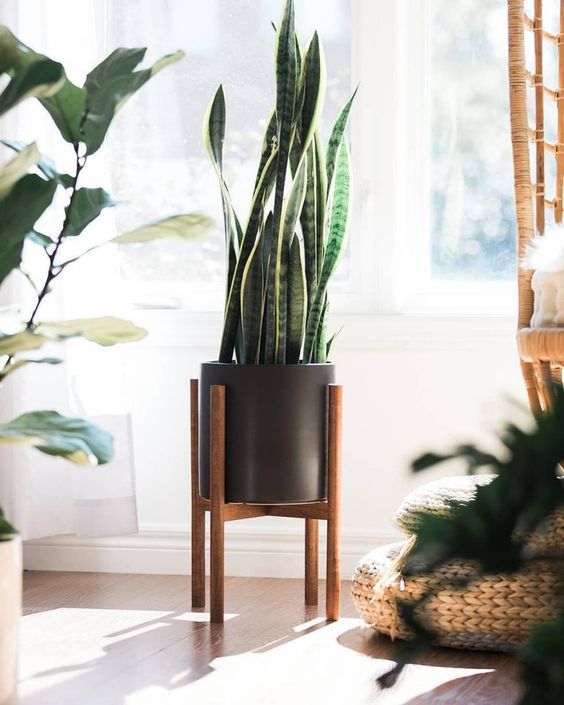
At what (x,y) coordinates should I click in order to perform the action: click on right side of a window. Please return your answer as a coordinate pair (x, y). The width and height of the screenshot is (564, 705). Looking at the image, I should click on (435, 209).